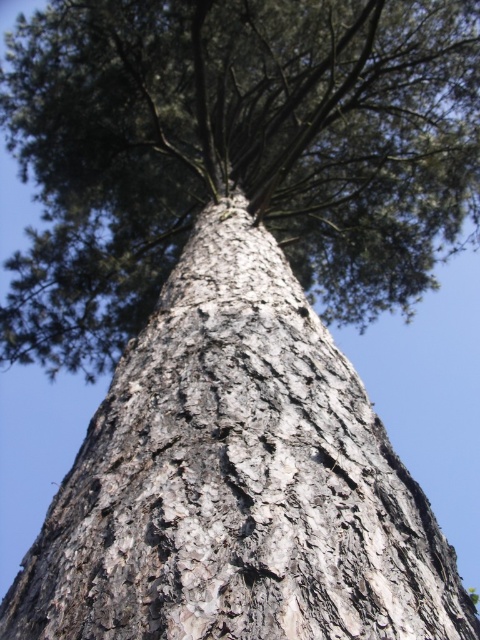
Question: Is smooth bark tree trunk at center positioned in front of gray textured bark at center?

Choices:
 (A) no
 (B) yes

Answer: (A)

Question: Considering the relative positions of smooth bark tree trunk at center and gray textured bark at center in the image provided, where is smooth bark tree trunk at center located with respect to gray textured bark at center?

Choices:
 (A) above
 (B) below

Answer: (A)

Question: Which object appears closest to the camera in this image?

Choices:
 (A) smooth bark tree trunk at center
 (B) gray textured bark at center

Answer: (B)

Question: Is smooth bark tree trunk at center positioned in front of gray textured bark at center?

Choices:
 (A) yes
 (B) no

Answer: (B)